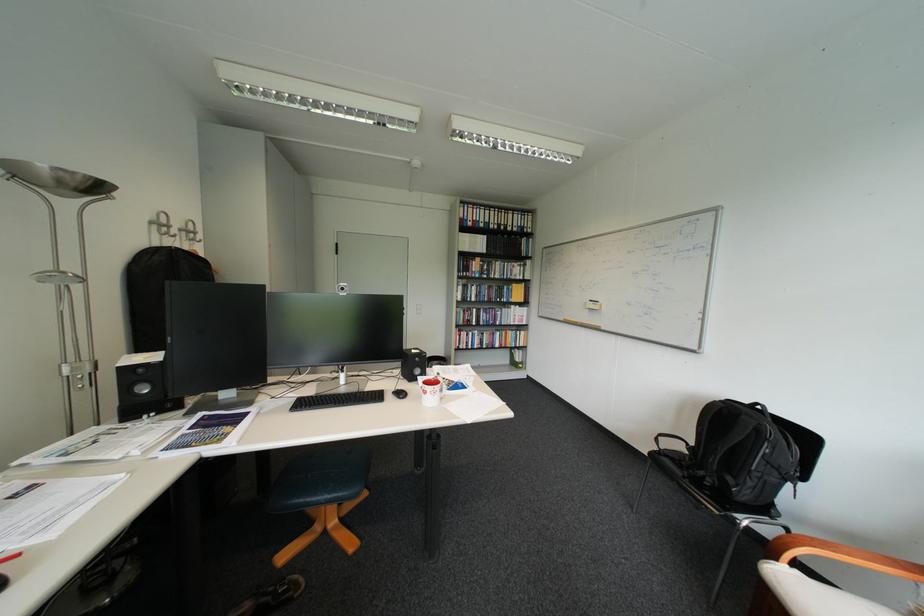
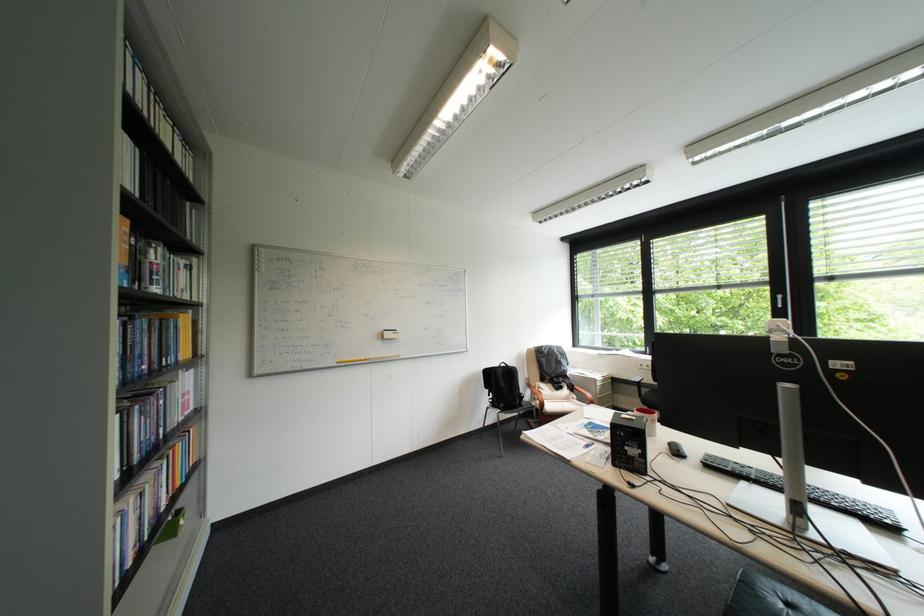
In the second image, find the point that corresponds to pixel 499 288 in the first image.

(159, 326)